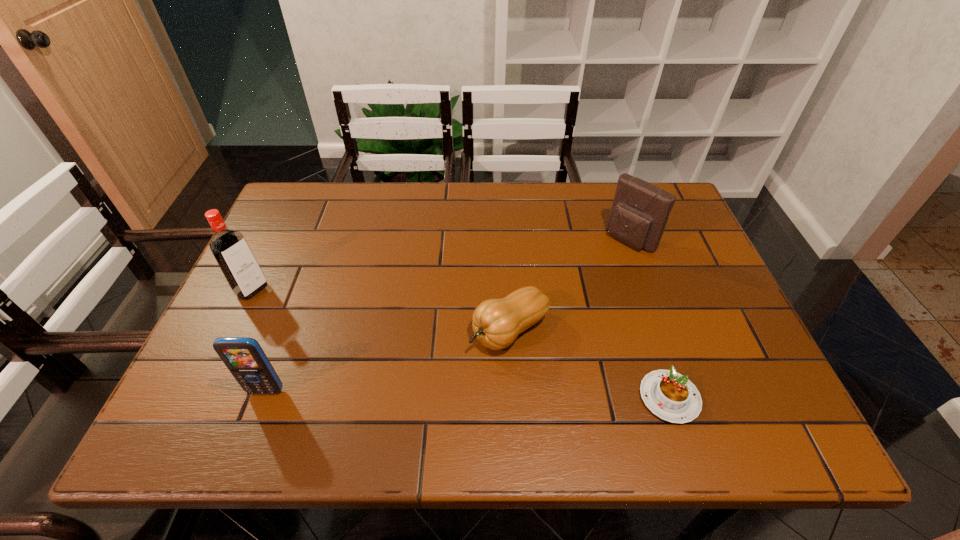
Locate an element on the screen. The image size is (960, 540). blank area at the far left corner is located at coordinates (302, 202).

Image resolution: width=960 pixels, height=540 pixels. I want to click on vacant space at the far right corner, so click(x=684, y=221).

Where is `free space between the pudding and the leftmost object`? free space between the pudding and the leftmost object is located at coordinates (461, 343).

Where is `free spot between the cellular telephone and the pudding`? The height and width of the screenshot is (540, 960). free spot between the cellular telephone and the pudding is located at coordinates (468, 394).

Find the location of a particular element. Image resolution: width=960 pixels, height=540 pixels. free space between the second object from left to right and the pudding is located at coordinates (468, 394).

At what (x,y) coordinates should I click in order to perform the action: click on vacant area between the third object from right to left and the vodka. Please return your answer as a coordinate pair (x, y). Image resolution: width=960 pixels, height=540 pixels. Looking at the image, I should click on (381, 310).

The width and height of the screenshot is (960, 540). I want to click on vacant area that lies between the shortest object and the cellular telephone, so click(468, 394).

I want to click on free spot between the cellular telephone and the farthest object, so click(x=448, y=315).

This screenshot has width=960, height=540. Identify the location of free space between the shortest object and the second farthest object. pyautogui.click(x=461, y=343).

The width and height of the screenshot is (960, 540). I want to click on vacant space that is in between the fourth object from right to left and the second shortest object, so click(x=388, y=360).